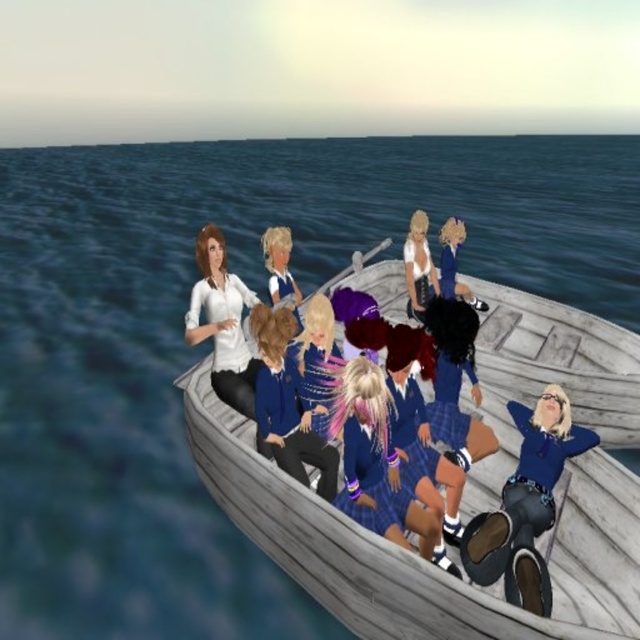
You are a character in the boat and want to pass a note to the person wearing the matte white shirt at upper left. Since you are standing near the matte blue jacket at center, can you directly hand the note to them without moving from your current position?

The matte white shirt at upper left is in front of the matte blue jacket at center, so yes, you can directly hand the note to them without moving since they are positioned in front of you.

Consider the image. You are standing on the deck of the boat and want to place a new decorative item exactly at the same coordinates as the plaid fabric skirt at center. What are the coordinates you should aim for?

The coordinates to aim for are exactly at point (376, 464), where the plaid fabric skirt at center is located.